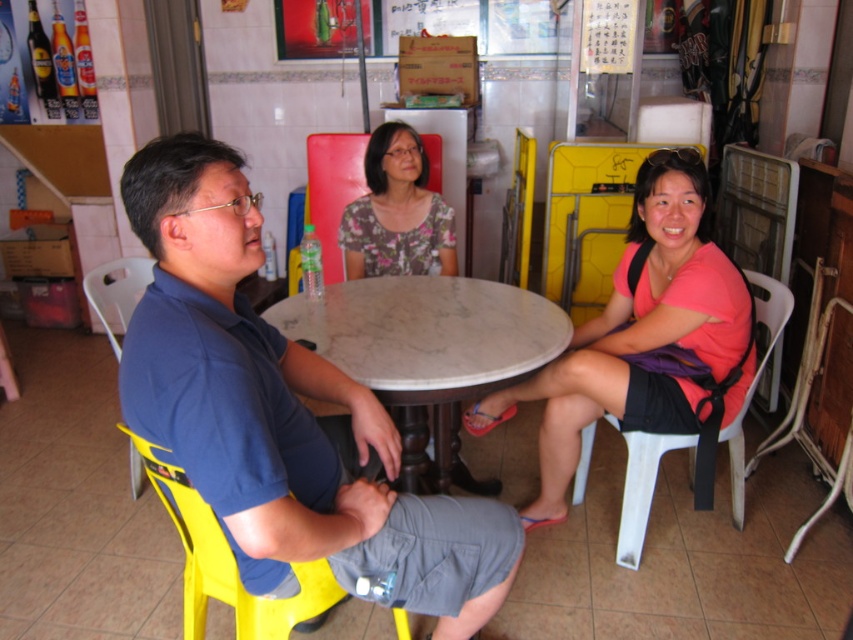
Question: Is the position of pink fabric shirt at center more distant than that of floral fabric blouse at center?

Choices:
 (A) no
 (B) yes

Answer: (A)

Question: Where is blue fabric shirt at center located in relation to white marble table at center in the image?

Choices:
 (A) right
 (B) left

Answer: (B)

Question: Among these objects, which one is farthest from the camera?

Choices:
 (A) blue fabric shirt at center
 (B) pink fabric shirt at center
 (C) floral fabric blouse at center

Answer: (C)

Question: Observing the image, what is the correct spatial positioning of white marble table at center in reference to white plastic chair at right?

Choices:
 (A) above
 (B) below

Answer: (A)

Question: Which point is farther from the camera taking this photo?

Choices:
 (A) (409, 493)
 (B) (447, 355)
 (C) (624, 365)
 (D) (683, 442)

Answer: (D)

Question: Which point is farther to the camera?

Choices:
 (A) [589, 426]
 (B) [171, 307]
 (C) [428, 310]
 (D) [384, 225]

Answer: (D)